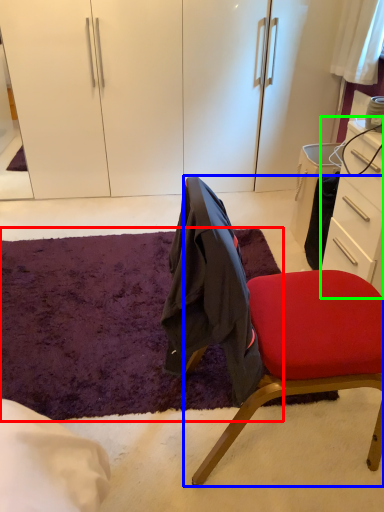
Question: Based on their relative distances, which object is farther from mat (highlighted by a red box)? Choose from chair (highlighted by a blue box) and desk (highlighted by a green box).

Choices:
 (A) chair
 (B) desk

Answer: (B)